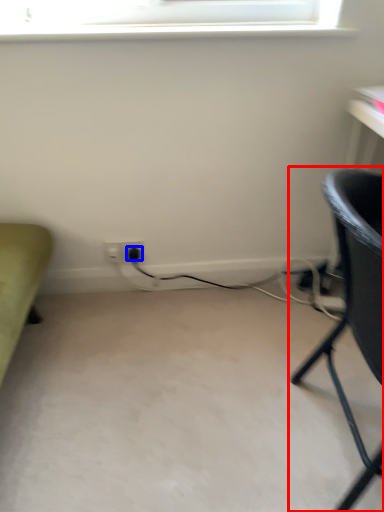
Question: Among these objects, which one is farthest to the camera, chair (highlighted by a red box) or plug (highlighted by a blue box)?

Choices:
 (A) chair
 (B) plug

Answer: (B)